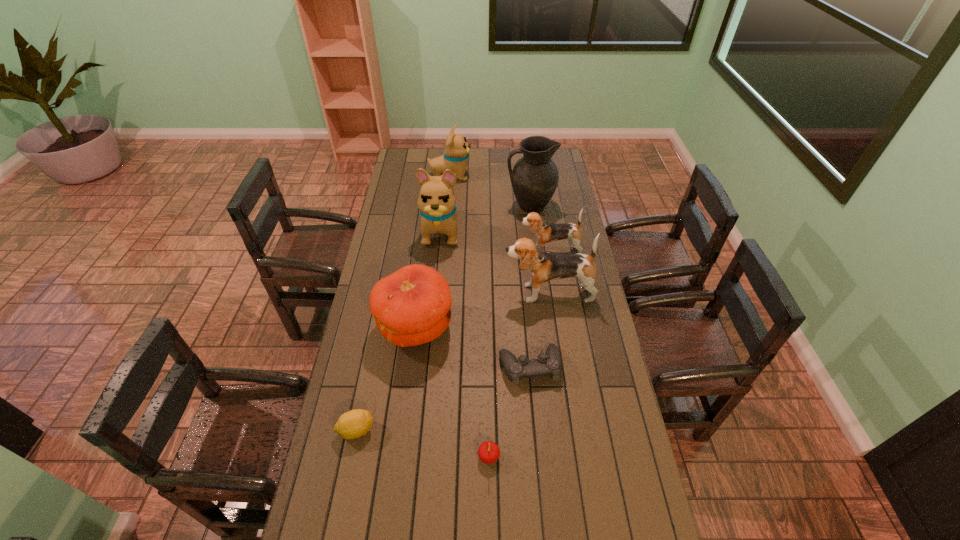
Where is `cherry`? This screenshot has width=960, height=540. cherry is located at coordinates (488, 452).

Where is `the second nearest object`? the second nearest object is located at coordinates (355, 423).

The height and width of the screenshot is (540, 960). In order to click on gray control in this screenshot , I will do `click(549, 363)`.

Identify the location of vacant space located 0.150m on the face of the bigger beige puppy. (437, 276).

The width and height of the screenshot is (960, 540). In order to click on vacant space located 0.340m on the side of the pitcher with the handle in this screenshot , I will do `click(436, 206)`.

I want to click on free space located on the side of the pitcher with the handle, so click(x=487, y=206).

This screenshot has width=960, height=540. In order to click on free space located 0.270m on the side of the pitcher with the handle in this screenshot , I will do `click(450, 206)`.

Locate an element on the screen. The height and width of the screenshot is (540, 960). vacant space situated 0.380m at the face of the nearest puppy is located at coordinates (408, 293).

Identify the location of vacant space located at the face of the nearest puppy. (403, 293).

Locate an element on the screen. The height and width of the screenshot is (540, 960). free space located at the face of the nearest puppy is located at coordinates click(481, 293).